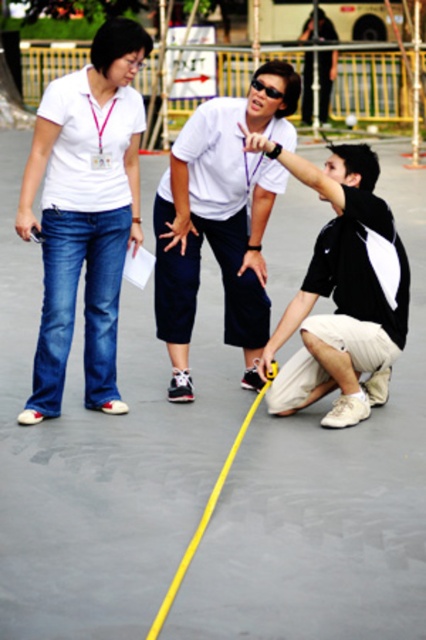
Question: Can you confirm if matte white shirt at upper left is positioned to the right of black matte tape measure at lower right?

Choices:
 (A) yes
 (B) no

Answer: (B)

Question: Which is farther from the black matte tape measure at lower right?

Choices:
 (A) matte white shirt at upper left
 (B) white matte shirt at center

Answer: (A)

Question: Does white matte shirt at center appear on the right side of black matte tape measure at lower right?

Choices:
 (A) no
 (B) yes

Answer: (A)

Question: Which of the following is the closest to the observer?

Choices:
 (A) (98, 381)
 (B) (241, 177)

Answer: (A)

Question: Which object is the farthest from the black matte tape measure at lower right?

Choices:
 (A) matte white shirt at upper left
 (B) white matte shirt at center

Answer: (A)

Question: Does matte white shirt at upper left have a smaller size compared to black matte tape measure at lower right?

Choices:
 (A) no
 (B) yes

Answer: (A)